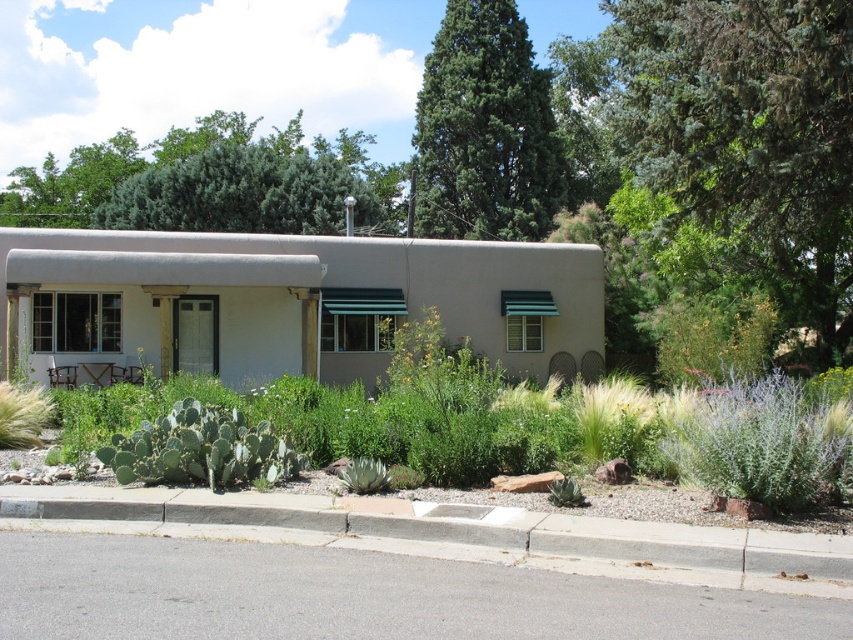
The image size is (853, 640). Identify the location of green leafy tree at upper right. (726, 147).

Is point (624, 188) positioned in front of point (734, 566)?

No, it is not.

Which is in front, point (744, 161) or point (738, 586)?

Point (738, 586) is in front.

Locate an element on the screen. green leafy tree at upper right is located at coordinates (726, 147).

In order to click on green textured tree at upper center in this screenshot , I will do `click(210, 180)`.

Which is more to the left, green textured tree at upper center or green spiny cactus at lower center?

Positioned to the left is green textured tree at upper center.

Does point (13, 225) come farther from viewer compared to point (222, 483)?

Yes, point (13, 225) is farther from viewer.

This screenshot has width=853, height=640. I want to click on green textured tree at upper center, so pyautogui.click(x=210, y=180).

Consider the image. Does gray concrete curb at lower center come behind green needle-like foliage at upper center?

No, gray concrete curb at lower center is closer to the viewer.

Is point (641, 529) positioned behind point (547, 160)?

No.

Locate an element on the screen. This screenshot has width=853, height=640. gray concrete curb at lower center is located at coordinates (456, 536).

Where is `gray concrete curb at lower center`? This screenshot has height=640, width=853. gray concrete curb at lower center is located at coordinates (456, 536).